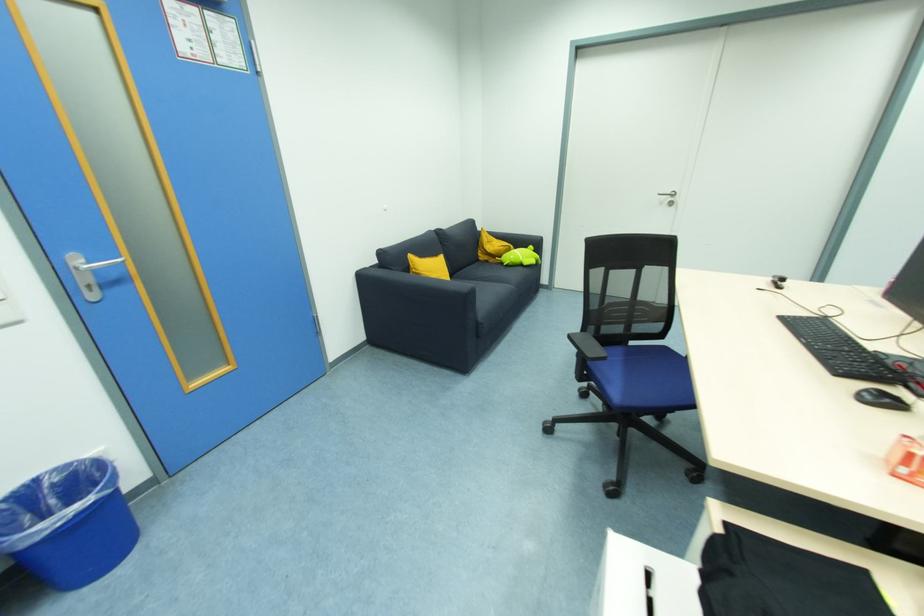
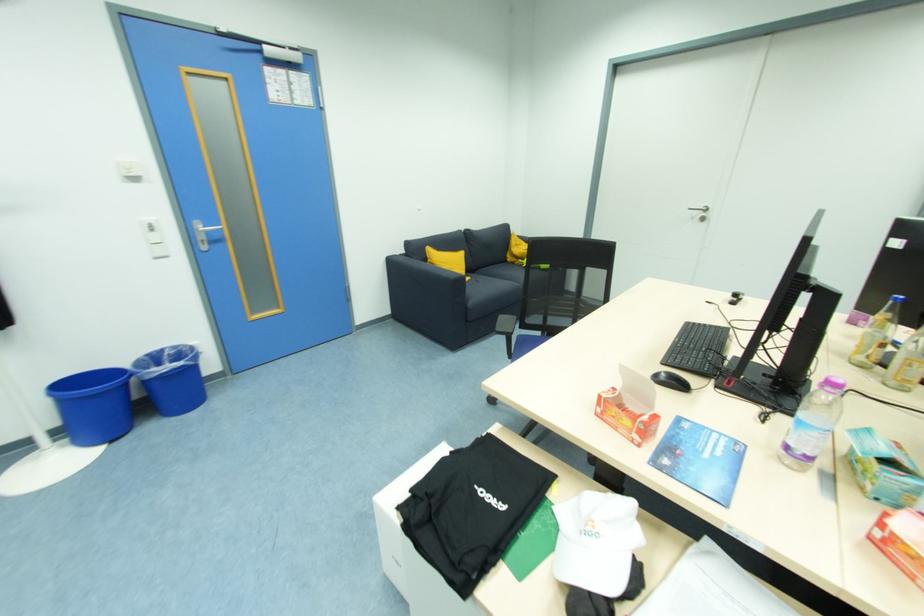
Where in the second image is the point corresponding to the point at 489,262 from the first image?

(516, 265)